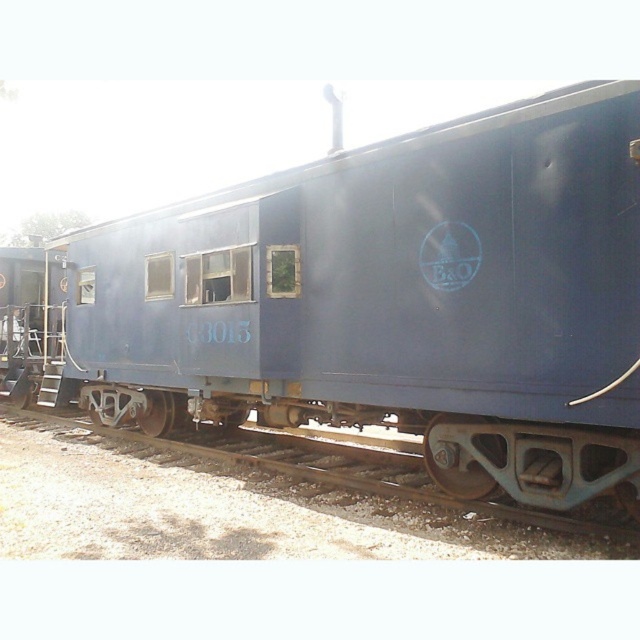
Question: Can you confirm if blue matte train car at center is wider than rusty metal track at lower center?

Choices:
 (A) no
 (B) yes

Answer: (B)

Question: Among these points, which one is farthest from the camera?

Choices:
 (A) (579, 413)
 (B) (144, 445)

Answer: (B)

Question: Is the position of blue matte train car at center more distant than that of rusty metal track at lower center?

Choices:
 (A) no
 (B) yes

Answer: (A)

Question: Does blue matte train car at center have a lesser width compared to rusty metal track at lower center?

Choices:
 (A) no
 (B) yes

Answer: (A)

Question: Which of the following is the farthest from the observer?

Choices:
 (A) (404, 353)
 (B) (632, 547)

Answer: (A)